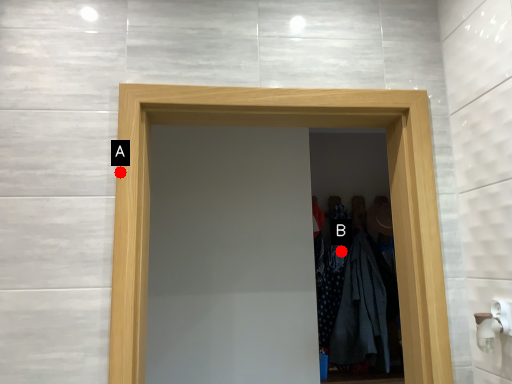
Question: Two points are circled on the image, labeled by A and B beside each circle. Which point appears closest to the camera in this image?

Choices:
 (A) A is closer
 (B) B is closer

Answer: (A)